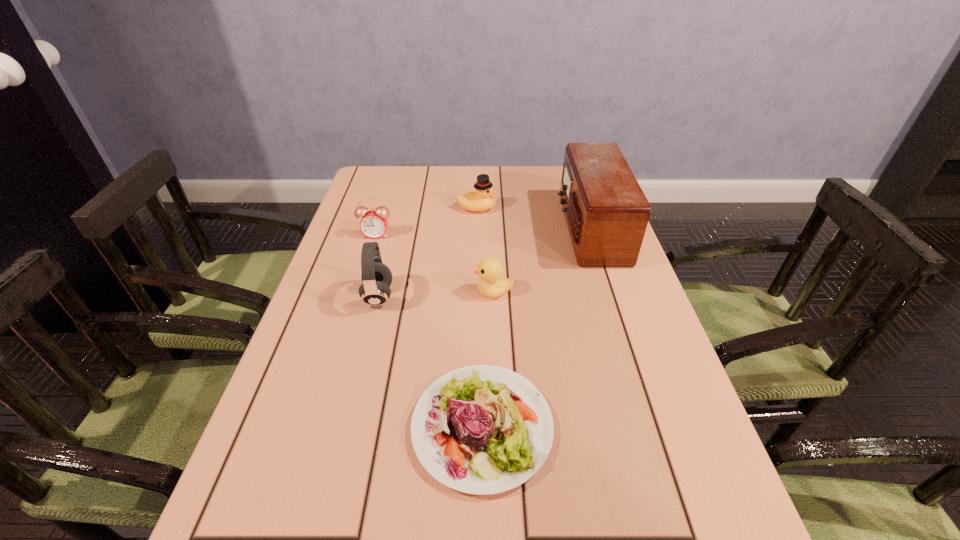
The width and height of the screenshot is (960, 540). Identify the location of radio receiver. (606, 211).

The width and height of the screenshot is (960, 540). I want to click on the tallest object, so coord(606,211).

This screenshot has width=960, height=540. Identify the location of the fifth shortest object. [x=376, y=277].

The width and height of the screenshot is (960, 540). In order to click on alarm clock in this screenshot , I will do `click(373, 224)`.

You are a GUI agent. You are given a task and a screenshot of the screen. Output one action in this format:
    pyautogui.click(x=<x>, y=<y>)
    Task: Click on the farther duck
    This screenshot has height=540, width=960.
    Given the screenshot: What is the action you would take?
    pyautogui.click(x=480, y=200)

Find the location of a particular element. The image size is (960, 540). the nearer duck is located at coordinates (491, 284).

Identify the location of the shortest object. This screenshot has width=960, height=540. (481, 429).

Identify the location of salad plate. (481, 429).

Where is `free region located on the front-facing side of the tallest object`? free region located on the front-facing side of the tallest object is located at coordinates (540, 229).

The image size is (960, 540). In order to click on vacant space located on the front-facing side of the tallest object in this screenshot , I will do `click(444, 229)`.